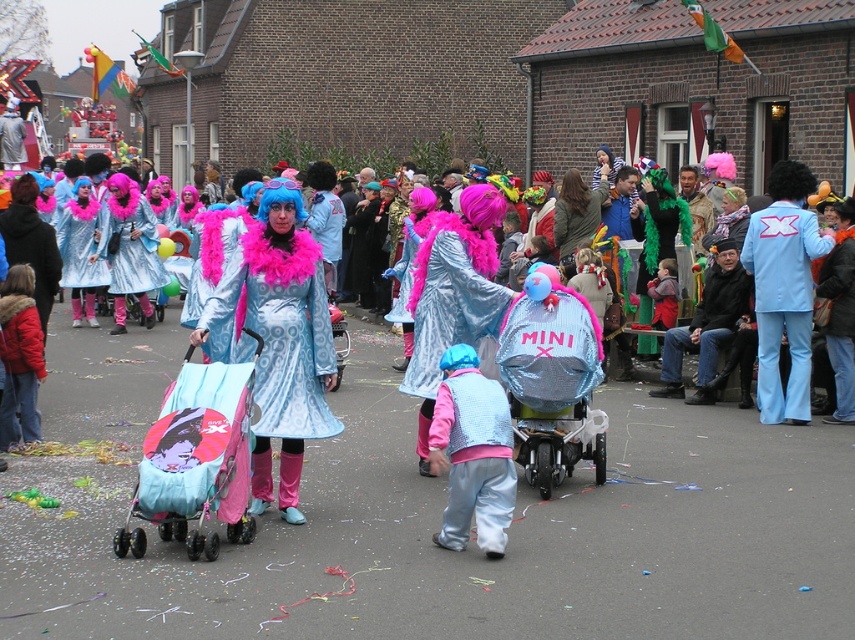
Question: Is shiny silver vest at center closer to camera compared to light blue fabric suit at right?

Choices:
 (A) yes
 (B) no

Answer: (A)

Question: Can you confirm if shiny blue dress at center is positioned to the left of shiny silver vest at center?

Choices:
 (A) yes
 (B) no

Answer: (A)

Question: Does shiny blue dress at center have a lesser width compared to matte pink fabric baby carriage at center?

Choices:
 (A) yes
 (B) no

Answer: (B)

Question: Which of the following is the closest to the observer?

Choices:
 (A) matte pink fabric baby carriage at center
 (B) shiny blue dress at center
 (C) shiny silver vest at center
 (D) light blue fabric suit at right

Answer: (A)

Question: Which object is the closest to the matte pink fabric baby carriage at center?

Choices:
 (A) shiny metallic coat at center
 (B) shiny silver vest at center
 (C) shiny blue dress at center

Answer: (C)

Question: Estimate the real-world distances between objects in this image. Which object is closer to the matte pink fabric baby carriage at center?

Choices:
 (A) shiny blue dress at center
 (B) shiny metallic coat at center

Answer: (A)